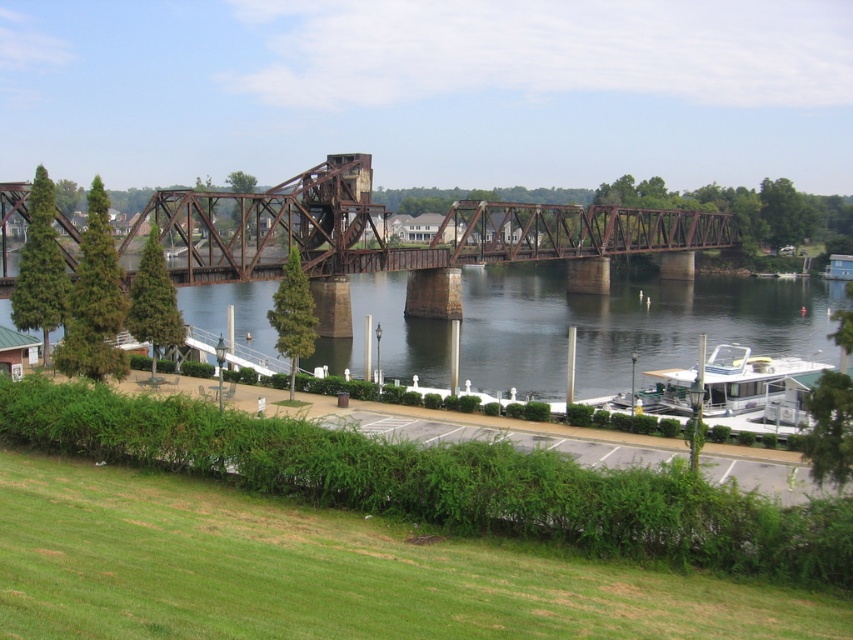
Question: Among these points, which one is nearest to the camera?

Choices:
 (A) (442, 250)
 (B) (212, 298)
 (C) (747, 432)

Answer: (C)

Question: Does dark brown water at center have a larger size compared to white glossy houseboat at lower right?

Choices:
 (A) yes
 (B) no

Answer: (A)

Question: Which point is farther from the camera taking this photo?

Choices:
 (A) (769, 422)
 (B) (473, 316)

Answer: (B)

Question: Can you confirm if dark brown water at center is smaller than rusty metal bridge at center?

Choices:
 (A) yes
 (B) no

Answer: (A)

Question: Considering the real-world distances, which object is closest to the white glossy houseboat at lower right?

Choices:
 (A) dark brown water at center
 (B) rusty metal bridge at center

Answer: (A)

Question: Is dark brown water at center bigger than white glossy houseboat at lower right?

Choices:
 (A) yes
 (B) no

Answer: (A)